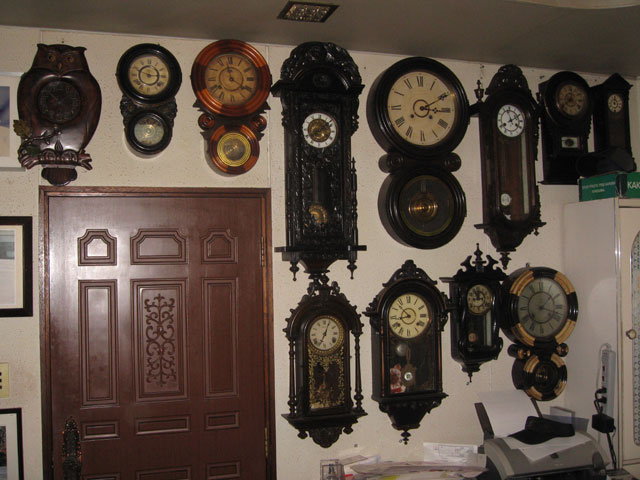
At what (x,y) coordinates should I click in order to perform the action: click on horizontal rectangle door panels. Please return your answer as a coordinate pair (x, y). Looking at the image, I should click on (102, 431), (155, 425), (220, 423), (104, 477), (176, 473), (225, 472).